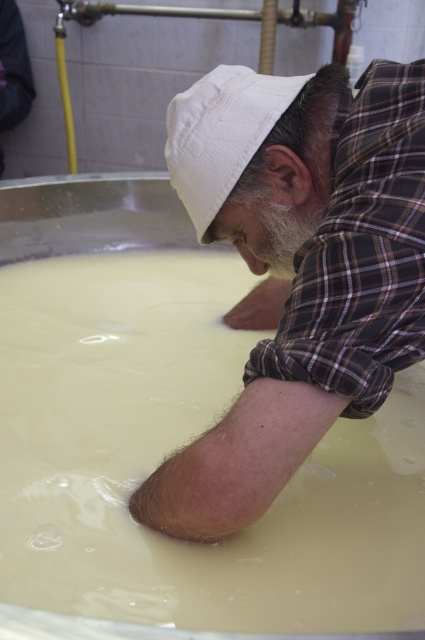
Question: Which object appears closest to the camera in this image?

Choices:
 (A) matte white hat at center
 (B) white creamy milk at center

Answer: (A)

Question: Does white creamy milk at center have a greater width compared to matte white hat at center?

Choices:
 (A) no
 (B) yes

Answer: (B)

Question: Is white creamy milk at center further to the viewer compared to matte white hat at center?

Choices:
 (A) no
 (B) yes

Answer: (B)

Question: Is white creamy milk at center thinner than matte white hat at center?

Choices:
 (A) no
 (B) yes

Answer: (A)

Question: Among these points, which one is farthest from the camera?

Choices:
 (A) (263, 413)
 (B) (303, 548)

Answer: (B)